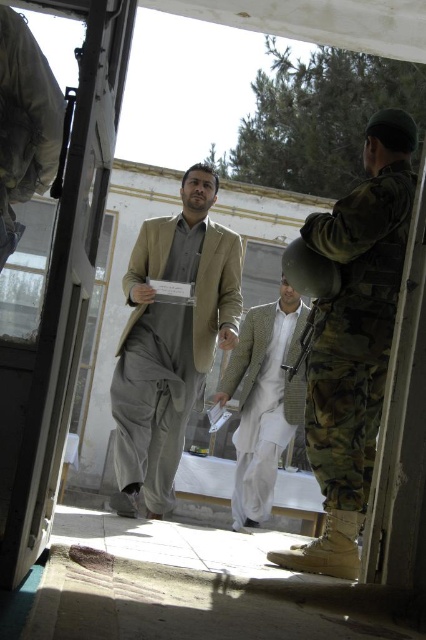
Question: Which point appears farthest from the camera in this image?

Choices:
 (A) (213, 291)
 (B) (244, 342)

Answer: (B)

Question: Does matte beige suit at center have a greater width compared to light brown textured suit at center?

Choices:
 (A) yes
 (B) no

Answer: (A)

Question: Which point appears farthest from the camera in this image?

Choices:
 (A) (268, 435)
 (B) (348, 308)
 (C) (203, 168)

Answer: (A)

Question: Does matte beige suit at center lie in front of light brown textured suit at center?

Choices:
 (A) yes
 (B) no

Answer: (A)

Question: Among these points, which one is nearest to the camera?

Choices:
 (A) (118, 497)
 (B) (354, 369)

Answer: (B)

Question: Can you confirm if camo uniform helmet at right is thinner than matte beige suit at center?

Choices:
 (A) no
 (B) yes

Answer: (B)